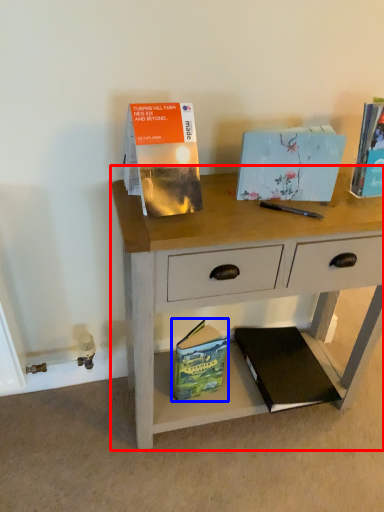
Question: Which of the following is the farthest to the observer, desk (highlighted by a red box) or paperback book (highlighted by a blue box)?

Choices:
 (A) desk
 (B) paperback book

Answer: (B)